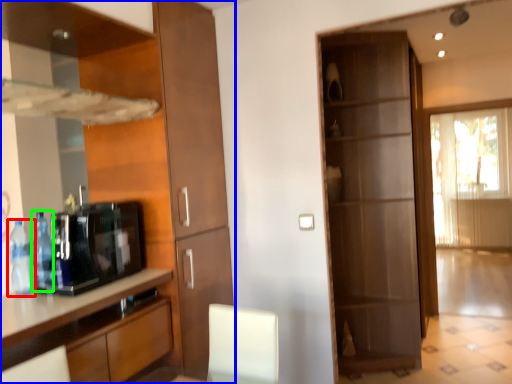
Question: Which is nearer to the bottle (highlighted by a red box)? cabinetry (highlighted by a blue box) or bottle (highlighted by a green box).

Choices:
 (A) cabinetry
 (B) bottle

Answer: (B)